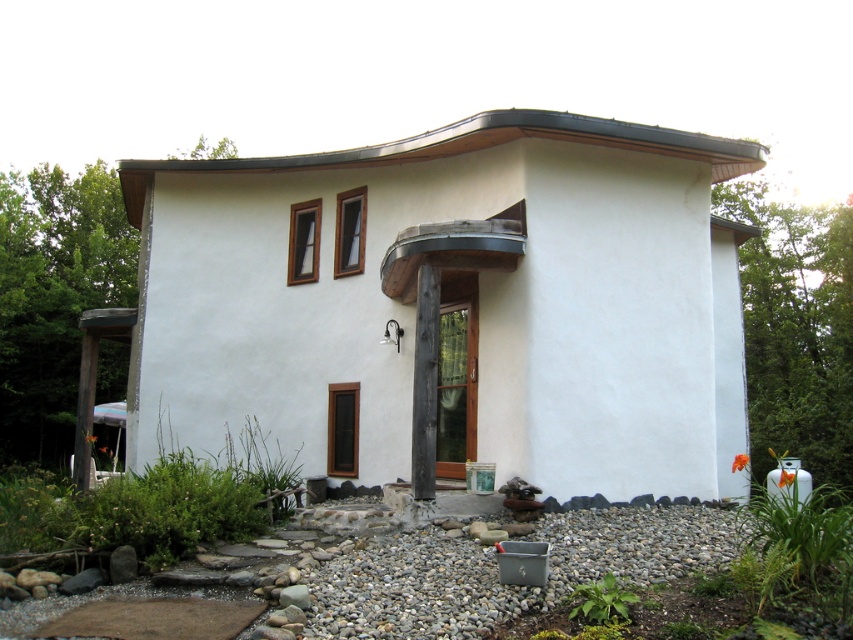
From the picture: Does gray stone at lower left have a greater width compared to gray smooth rock at lower center?

In fact, gray stone at lower left might be narrower than gray smooth rock at lower center.

Between point (117, 572) and point (279, 596), which one is positioned behind?

Point (117, 572)

Where is `gray stone at lower left`? gray stone at lower left is located at coordinates click(122, 564).